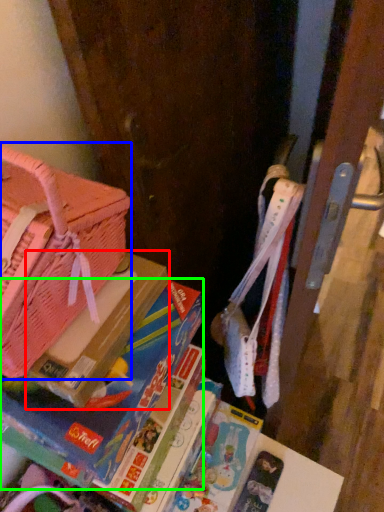
Question: Considering the real-world distances, which object is farthest from paperback book (highlighted by a red box)? handbag (highlighted by a blue box) or book (highlighted by a green box)?

Choices:
 (A) handbag
 (B) book

Answer: (A)